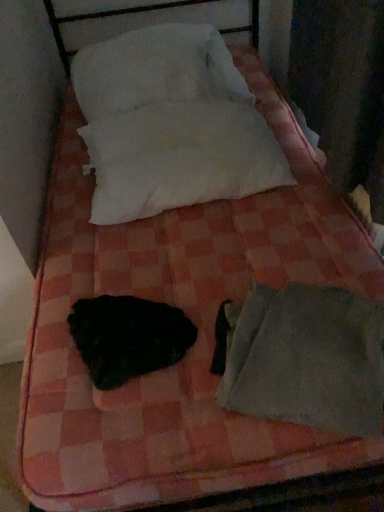
The image size is (384, 512). What do you see at coordinates (308, 359) in the screenshot?
I see `gray fabric sleeping bag at lower right` at bounding box center [308, 359].

Looking at this image, measure the distance between white cotton pillow at upper center, the 1th pillow when ordered from bottom to top, and camera.

They are 1.28 meters apart.

The height and width of the screenshot is (512, 384). I want to click on white soft pillow at upper center, positioned as the second pillow in bottom-to-top order, so click(x=156, y=70).

The width and height of the screenshot is (384, 512). What are the coordinates of `black fuzzy animal at center` in the screenshot? It's located at (128, 337).

Locate an element on the screen. gray fabric sleeping bag at lower right is located at coordinates (308, 359).

Between white cotton pillow at upper center, the 2th pillow from the top, and black fuzzy animal at center, which one appears on the left side from the viewer's perspective?

From the viewer's perspective, black fuzzy animal at center appears more on the left side.

Does point (179, 196) come closer to viewer compared to point (77, 336)?

No, (179, 196) is further to viewer.

Considering the relative sizes of white cotton pillow at upper center, the 1th pillow when ordered from bottom to top, and black fuzzy animal at center in the image provided, is white cotton pillow at upper center, the 1th pillow when ordered from bottom to top, thinner than black fuzzy animal at center?

In fact, white cotton pillow at upper center, the 1th pillow when ordered from bottom to top, might be wider than black fuzzy animal at center.

In the scene shown: From the image's perspective, is white soft pillow at upper center, positioned as the second pillow in bottom-to-top order, above or below black fuzzy animal at center?

white soft pillow at upper center, positioned as the second pillow in bottom-to-top order, is situated higher than black fuzzy animal at center in the image.

Which of these two, white soft pillow at upper center, positioned as the 1th pillow in top-to-bottom order, or black fuzzy animal at center, stands taller?

white soft pillow at upper center, positioned as the 1th pillow in top-to-bottom order.

Is white soft pillow at upper center, positioned as the 1th pillow in top-to-bottom order, not inside black fuzzy animal at center?

Yes.

Does white soft pillow at upper center, positioned as the second pillow in bottom-to-top order, have a lesser width compared to black fuzzy animal at center?

No.

From a real-world perspective, is white cotton pillow at upper center, the 1th pillow when ordered from bottom to top, located higher than gray fabric sleeping bag at lower right?

Yes.

From the picture: Is white cotton pillow at upper center, the 2th pillow from the top, at the right side of gray fabric sleeping bag at lower right?

No.

In the scene shown: Measure the distance from white cotton pillow at upper center, the 2th pillow from the top, to gray fabric sleeping bag at lower right.

They are 24.27 inches apart.

Is there a large distance between white cotton pillow at upper center, the 1th pillow when ordered from bottom to top, and gray fabric sleeping bag at lower right?

That's not correct — white cotton pillow at upper center, the 1th pillow when ordered from bottom to top, is a little close to gray fabric sleeping bag at lower right.

From a real-world perspective, is gray fabric sleeping bag at lower right located beneath white soft pillow at upper center, positioned as the second pillow in bottom-to-top order?

Yes, from a real-world perspective, gray fabric sleeping bag at lower right is under white soft pillow at upper center, positioned as the second pillow in bottom-to-top order.

Is gray fabric sleeping bag at lower right aimed at white soft pillow at upper center, positioned as the second pillow in bottom-to-top order?

No, gray fabric sleeping bag at lower right is not turned towards white soft pillow at upper center, positioned as the second pillow in bottom-to-top order.

Is gray fabric sleeping bag at lower right next to white soft pillow at upper center, positioned as the second pillow in bottom-to-top order, and touching it?

No, gray fabric sleeping bag at lower right is not next to white soft pillow at upper center, positioned as the second pillow in bottom-to-top order.

Which is behind, point (291, 313) or point (245, 100)?

The point (245, 100) is farther.

Considering the sizes of objects white cotton pillow at upper center, the 1th pillow when ordered from bottom to top, and white soft pillow at upper center, positioned as the second pillow in bottom-to-top order, in the image provided, who is taller, white cotton pillow at upper center, the 1th pillow when ordered from bottom to top, or white soft pillow at upper center, positioned as the second pillow in bottom-to-top order,?

white soft pillow at upper center, positioned as the second pillow in bottom-to-top order, is taller.

From a real-world perspective, is white cotton pillow at upper center, the 1th pillow when ordered from bottom to top, physically located above or below white soft pillow at upper center, positioned as the 1th pillow in top-to-bottom order?

white cotton pillow at upper center, the 1th pillow when ordered from bottom to top, is below white soft pillow at upper center, positioned as the 1th pillow in top-to-bottom order.

Are white cotton pillow at upper center, the 2th pillow from the top, and white soft pillow at upper center, positioned as the second pillow in bottom-to-top order, making contact?

No, white cotton pillow at upper center, the 2th pillow from the top, is not beside white soft pillow at upper center, positioned as the second pillow in bottom-to-top order.

Is white soft pillow at upper center, positioned as the 1th pillow in top-to-bottom order, at the back of white cotton pillow at upper center, the 2th pillow from the top?

Yes, white cotton pillow at upper center, the 2th pillow from the top, is facing away from white soft pillow at upper center, positioned as the 1th pillow in top-to-bottom order.

Does point (150, 64) appear closer or farther from the camera than point (287, 321)?

Point (150, 64).

From the picture: Is gray fabric sleeping bag at lower right located within white soft pillow at upper center, positioned as the 1th pillow in top-to-bottom order?

Actually, gray fabric sleeping bag at lower right is outside white soft pillow at upper center, positioned as the 1th pillow in top-to-bottom order.

From the picture: Is the position of white soft pillow at upper center, positioned as the second pillow in bottom-to-top order, less distant than that of gray fabric sleeping bag at lower right?

No, it is behind gray fabric sleeping bag at lower right.

Which of these two, white soft pillow at upper center, positioned as the second pillow in bottom-to-top order, or gray fabric sleeping bag at lower right, is smaller?

Smaller between the two is gray fabric sleeping bag at lower right.

Is black fuzzy animal at center not inside white soft pillow at upper center, positioned as the 1th pillow in top-to-bottom order?

Indeed, black fuzzy animal at center is completely outside white soft pillow at upper center, positioned as the 1th pillow in top-to-bottom order.

Is black fuzzy animal at center further to camera compared to white soft pillow at upper center, positioned as the second pillow in bottom-to-top order?

No, black fuzzy animal at center is in front of white soft pillow at upper center, positioned as the second pillow in bottom-to-top order.

Locate an element on the screen. The width and height of the screenshot is (384, 512). animal on the left of white cotton pillow at upper center, the 2th pillow from the top is located at coordinates (128, 337).

This screenshot has width=384, height=512. I want to click on pillow that is the 2nd one when counting backward from the black fuzzy animal at center, so click(156, 70).

From the image, which object appears to be farther from black fuzzy animal at center, white soft pillow at upper center, positioned as the 1th pillow in top-to-bottom order, or white cotton pillow at upper center, the 1th pillow when ordered from bottom to top?

white soft pillow at upper center, positioned as the 1th pillow in top-to-bottom order, is positioned further to the anchor black fuzzy animal at center.

Looking at this image, estimate the real-world distances between objects in this image. Which object is further from gray fabric sleeping bag at lower right, white soft pillow at upper center, positioned as the second pillow in bottom-to-top order, or black fuzzy animal at center?

white soft pillow at upper center, positioned as the second pillow in bottom-to-top order, lies further to gray fabric sleeping bag at lower right than the other object.

When comparing their distances from white cotton pillow at upper center, the 2th pillow from the top, does black fuzzy animal at center or gray fabric sleeping bag at lower right seem further?

Answer: Based on the image, gray fabric sleeping bag at lower right appears to be further to white cotton pillow at upper center, the 2th pillow from the top.

Considering their positions, is white cotton pillow at upper center, the 2th pillow from the top, positioned closer to white soft pillow at upper center, positioned as the second pillow in bottom-to-top order, than black fuzzy animal at center?

white cotton pillow at upper center, the 2th pillow from the top, is positioned closer to the anchor white soft pillow at upper center, positioned as the second pillow in bottom-to-top order.

When comparing their distances from white cotton pillow at upper center, the 1th pillow when ordered from bottom to top, does white soft pillow at upper center, positioned as the second pillow in bottom-to-top order, or gray fabric sleeping bag at lower right seem further?

gray fabric sleeping bag at lower right.

Which object lies nearer to the anchor point white soft pillow at upper center, positioned as the 1th pillow in top-to-bottom order, black fuzzy animal at center or gray fabric sleeping bag at lower right?

black fuzzy animal at center lies closer to white soft pillow at upper center, positioned as the 1th pillow in top-to-bottom order, than the other object.

From the image, which object appears to be farther from black fuzzy animal at center, white cotton pillow at upper center, the 2th pillow from the top, or gray fabric sleeping bag at lower right?

white cotton pillow at upper center, the 2th pillow from the top, is positioned further to the anchor black fuzzy animal at center.

From the image, which object appears to be farther from gray fabric sleeping bag at lower right, black fuzzy animal at center or white cotton pillow at upper center, the 1th pillow when ordered from bottom to top?

The object further to gray fabric sleeping bag at lower right is white cotton pillow at upper center, the 1th pillow when ordered from bottom to top.

Locate an element on the screen. This screenshot has height=512, width=384. animal that lies between white cotton pillow at upper center, the 2th pillow from the top, and gray fabric sleeping bag at lower right from top to bottom is located at coordinates (128, 337).

I want to click on pillow between white soft pillow at upper center, positioned as the 1th pillow in top-to-bottom order, and black fuzzy animal at center in the up-down direction, so click(x=180, y=158).

I want to click on animal that lies between white soft pillow at upper center, positioned as the second pillow in bottom-to-top order, and gray fabric sleeping bag at lower right from top to bottom, so click(128, 337).

Where is `pillow between white soft pillow at upper center, positioned as the second pillow in bottom-to-top order, and gray fabric sleeping bag at lower right from top to bottom`? This screenshot has width=384, height=512. pillow between white soft pillow at upper center, positioned as the second pillow in bottom-to-top order, and gray fabric sleeping bag at lower right from top to bottom is located at coordinates (180, 158).